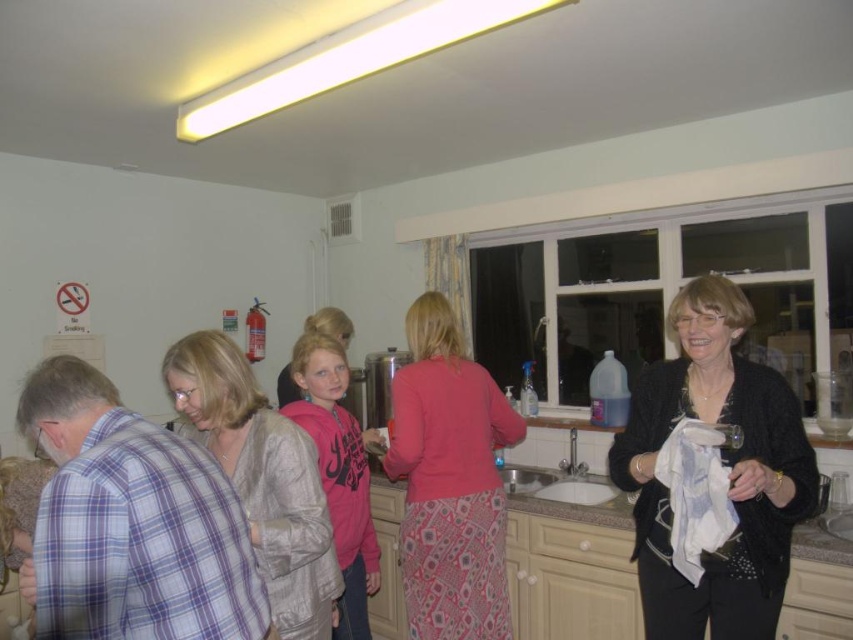
Who is shorter, black knitwear at right or white ceramic sink at center?

white ceramic sink at center

In the scene shown: Which is below, black knitwear at right or white ceramic sink at center?

white ceramic sink at center is lower down.

Identify the location of black knitwear at right. (724, 465).

Does point (352, 492) lie in front of point (570, 493)?

Yes.

Who is higher up, pink fleece jacket at center or white ceramic sink at center?

white ceramic sink at center is higher up.

Describe the element at coordinates (338, 474) in the screenshot. I see `pink fleece jacket at center` at that location.

Image resolution: width=853 pixels, height=640 pixels. I want to click on pink fleece jacket at center, so click(x=338, y=474).

What are the coordinates of `black knitwear at right` in the screenshot? It's located at (724, 465).

Locate an element on the screen. This screenshot has height=640, width=853. black knitwear at right is located at coordinates (724, 465).

You are a GUI agent. You are given a task and a screenshot of the screen. Output one action in this format:
    pyautogui.click(x=<x>, y=<y>)
    Task: Click on the black knitwear at right
    This screenshot has width=853, height=640.
    Given the screenshot: What is the action you would take?
    pyautogui.click(x=724, y=465)